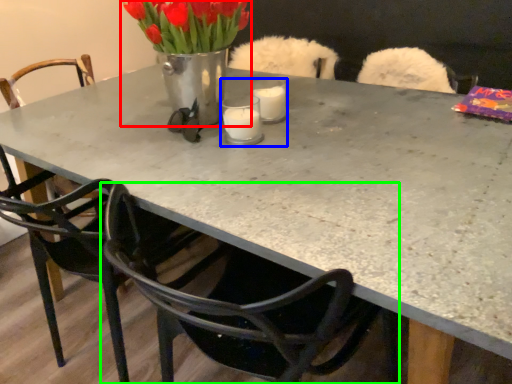
Question: Which object is the farthest from floral arrangement (highlighted by a red box)? Choose among these: candle holder (highlighted by a blue box) or chair (highlighted by a green box).

Choices:
 (A) candle holder
 (B) chair

Answer: (B)